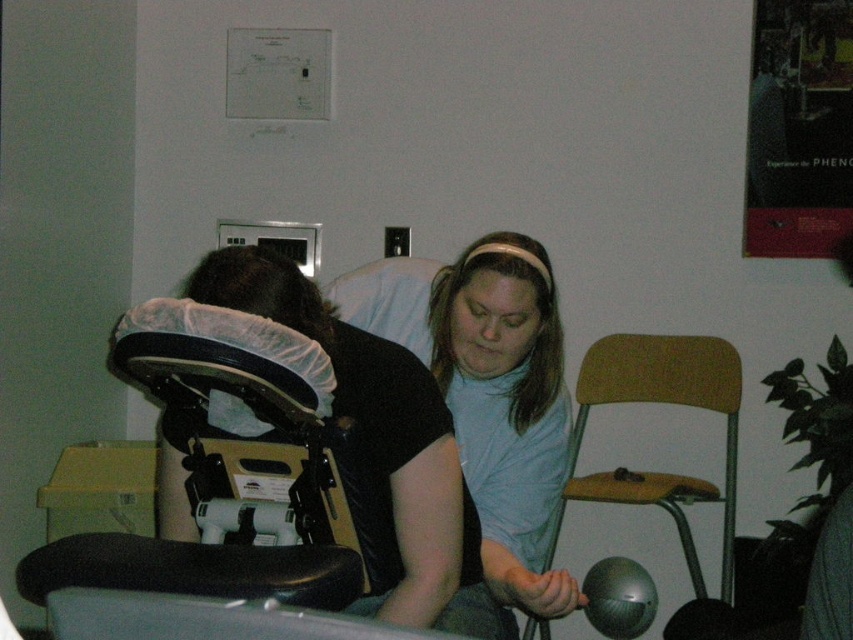
Question: Considering the real-world distances, which object is farthest from the wooden swivel chair at center-right?

Choices:
 (A) light blue fabric at center
 (B) black leather baby carriage at left
 (C) matte black helmet at center

Answer: (B)

Question: Does black leather baby carriage at left appear on the left side of matte black helmet at center?

Choices:
 (A) no
 (B) yes

Answer: (B)

Question: Does black leather baby carriage at left have a lesser width compared to wooden swivel chair at center-right?

Choices:
 (A) yes
 (B) no

Answer: (A)

Question: Can you confirm if light blue fabric at center is smaller than matte black helmet at center?

Choices:
 (A) no
 (B) yes

Answer: (A)

Question: Which object is farther from the camera taking this photo?

Choices:
 (A) wooden swivel chair at center-right
 (B) matte black helmet at center
 (C) black leather baby carriage at left
 (D) light blue fabric at center

Answer: (A)

Question: Considering the real-world distances, which object is farthest from the light blue fabric at center?

Choices:
 (A) matte black helmet at center
 (B) black leather baby carriage at left
 (C) wooden swivel chair at center-right

Answer: (C)